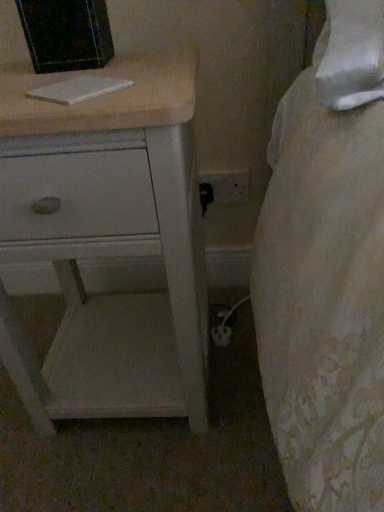
Question: Is white painted wood chest of drawers at left inside white matte book at upper left?

Choices:
 (A) yes
 (B) no

Answer: (B)

Question: Can you confirm if white matte book at upper left is taller than white painted wood chest of drawers at left?

Choices:
 (A) yes
 (B) no

Answer: (B)

Question: From a real-world perspective, is white matte book at upper left located higher than white painted wood chest of drawers at left?

Choices:
 (A) no
 (B) yes

Answer: (B)

Question: Can we say white matte book at upper left lies outside white painted wood chest of drawers at left?

Choices:
 (A) no
 (B) yes

Answer: (A)

Question: From a real-world perspective, is white matte book at upper left below white painted wood chest of drawers at left?

Choices:
 (A) no
 (B) yes

Answer: (A)

Question: Does white matte book at upper left have a smaller size compared to white painted wood chest of drawers at left?

Choices:
 (A) yes
 (B) no

Answer: (A)

Question: Does white painted wood chest of drawers at left have a greater width compared to white matte book at upper left?

Choices:
 (A) no
 (B) yes

Answer: (B)

Question: Considering the relative sizes of white painted wood chest of drawers at left and white matte book at upper left in the image provided, is white painted wood chest of drawers at left taller than white matte book at upper left?

Choices:
 (A) yes
 (B) no

Answer: (A)

Question: Is white painted wood chest of drawers at left facing towards white matte book at upper left?

Choices:
 (A) yes
 (B) no

Answer: (B)

Question: Is there a large distance between white painted wood chest of drawers at left and white matte book at upper left?

Choices:
 (A) no
 (B) yes

Answer: (A)

Question: Can you confirm if white painted wood chest of drawers at left is shorter than white matte book at upper left?

Choices:
 (A) no
 (B) yes

Answer: (A)

Question: From the image's perspective, is white painted wood chest of drawers at left on white matte book at upper left?

Choices:
 (A) no
 (B) yes

Answer: (A)

Question: In terms of width, does white painted wood chest of drawers at left look wider or thinner when compared to white matte book at upper left?

Choices:
 (A) wide
 (B) thin

Answer: (A)